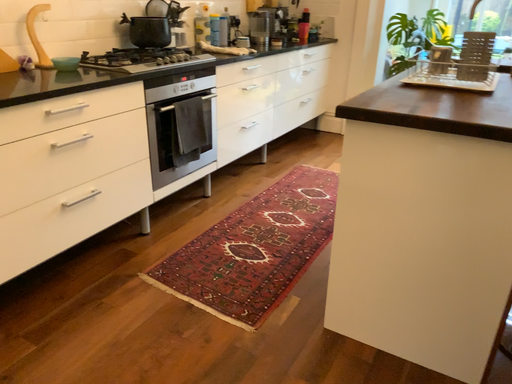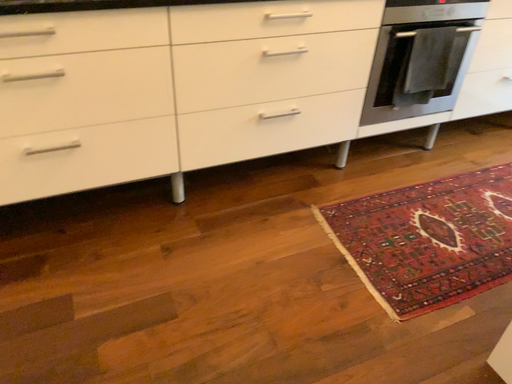
Question: Which way did the camera rotate in the video?

Choices:
 (A) rotated left
 (B) rotated right

Answer: (A)